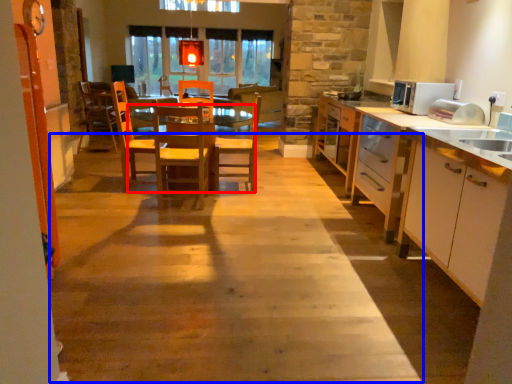
Question: Which object appears closest to the camera in this image, table (highlighted by a red box) or path (highlighted by a blue box)?

Choices:
 (A) table
 (B) path

Answer: (B)